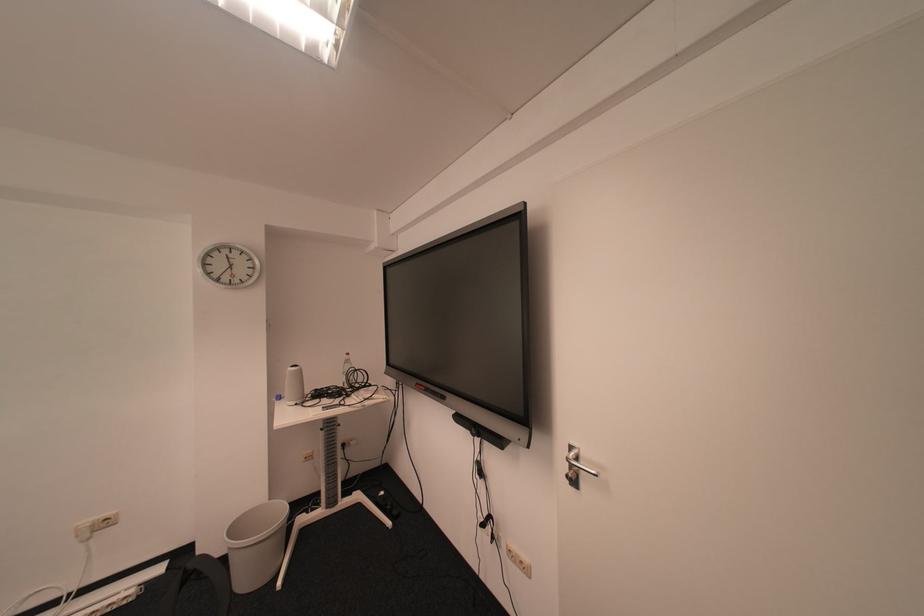
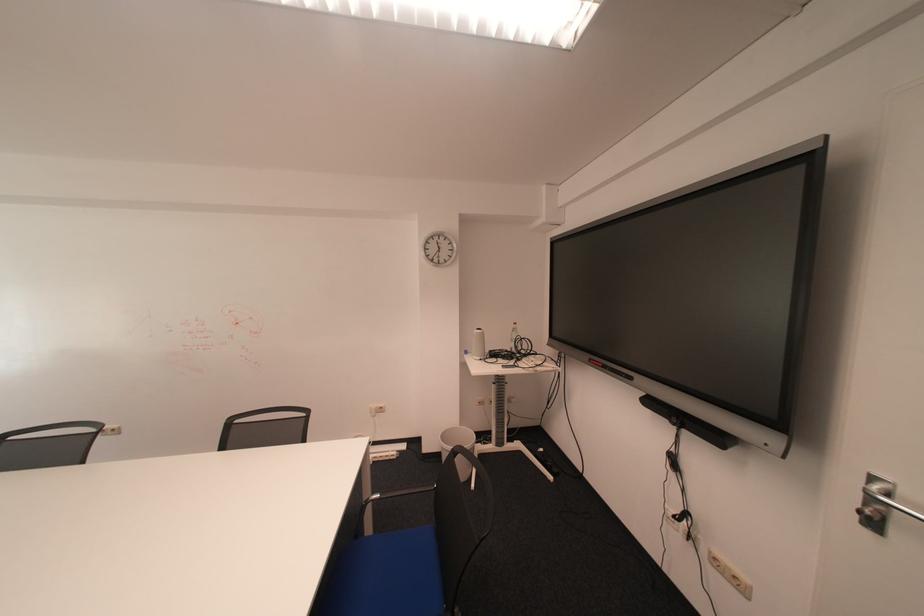
Where in the second image is the point corresponding to (x=537, y=569) from the first image?

(751, 586)